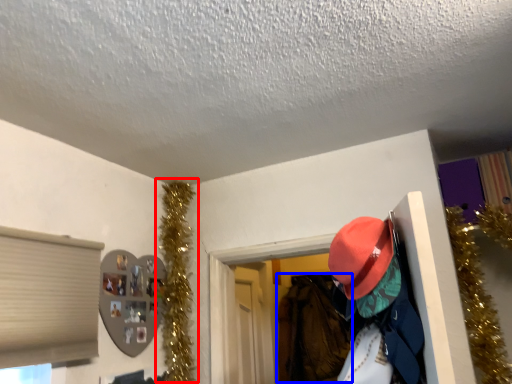
Question: Which object is closer to the camera taking this photo, christmas decoration (highlighted by a red box) or clothing (highlighted by a blue box)?

Choices:
 (A) christmas decoration
 (B) clothing

Answer: (A)